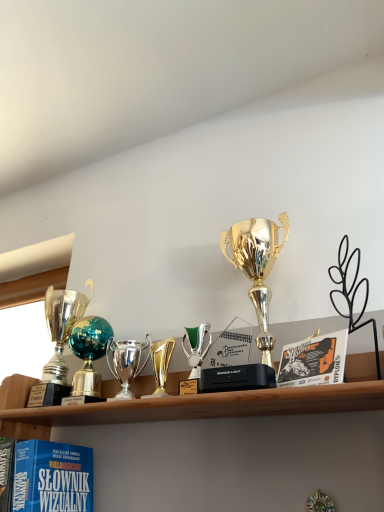
Question: From a real-world perspective, is polished silver trophy at center, acting as the 3th trophy starting from the right, located higher than gold shiny trophy at center, placed as the 2th trophy when sorted from right to left?

Choices:
 (A) yes
 (B) no

Answer: (A)

Question: Is polished silver trophy at center, acting as the 3th trophy starting from the right, in contact with gold shiny trophy at center, placed as the 2th trophy when sorted from right to left?

Choices:
 (A) yes
 (B) no

Answer: (A)

Question: From the image's perspective, does polished silver trophy at center, acting as the 3th trophy starting from the right, appear lower than gold shiny trophy at center, the third trophy when ordered from left to right?

Choices:
 (A) no
 (B) yes

Answer: (B)

Question: Does polished silver trophy at center, acting as the 3th trophy starting from the right, have a lesser height compared to gold shiny trophy at center, the third trophy when ordered from left to right?

Choices:
 (A) no
 (B) yes

Answer: (A)

Question: From the image's perspective, is polished silver trophy at center, acting as the 3th trophy starting from the right, on top of gold shiny trophy at center, placed as the 2th trophy when sorted from right to left?

Choices:
 (A) yes
 (B) no

Answer: (B)

Question: In terms of height, does gold shiny trophy at center, the third trophy when ordered from left to right, look taller or shorter compared to matte blue book at lower left?

Choices:
 (A) tall
 (B) short

Answer: (B)

Question: In terms of size, does gold shiny trophy at center, the third trophy when ordered from left to right, appear bigger or smaller than matte blue book at lower left?

Choices:
 (A) small
 (B) big

Answer: (A)

Question: In the image, is gold shiny trophy at center, the third trophy when ordered from left to right, positioned in front of or behind matte blue book at lower left?

Choices:
 (A) behind
 (B) front

Answer: (A)

Question: From a real-world perspective, is gold shiny trophy at center, placed as the 2th trophy when sorted from right to left, above or below matte blue book at lower left?

Choices:
 (A) above
 (B) below

Answer: (A)

Question: Based on their sizes in the image, would you say gold shiny trophy at center, the third trophy when ordered from left to right, is bigger or smaller than metallic trophy at left?

Choices:
 (A) small
 (B) big

Answer: (A)

Question: From the image's perspective, relative to metallic trophy at left, is gold shiny trophy at center, placed as the 2th trophy when sorted from right to left, above or below?

Choices:
 (A) above
 (B) below

Answer: (B)

Question: Relative to metallic trophy at left, is gold shiny trophy at center, placed as the 2th trophy when sorted from right to left, in front or behind?

Choices:
 (A) behind
 (B) front

Answer: (B)

Question: Is point (167, 340) positioned closer to the camera than point (1, 287)?

Choices:
 (A) closer
 (B) farther

Answer: (A)

Question: From the image's perspective, relative to matte blue book at lower left, is polished silver trophy at center, placed as the second trophy when sorted from left to right, above or below?

Choices:
 (A) above
 (B) below

Answer: (A)

Question: Looking at their shapes, would you say polished silver trophy at center, placed as the second trophy when sorted from left to right, is wider or thinner than matte blue book at lower left?

Choices:
 (A) wide
 (B) thin

Answer: (B)